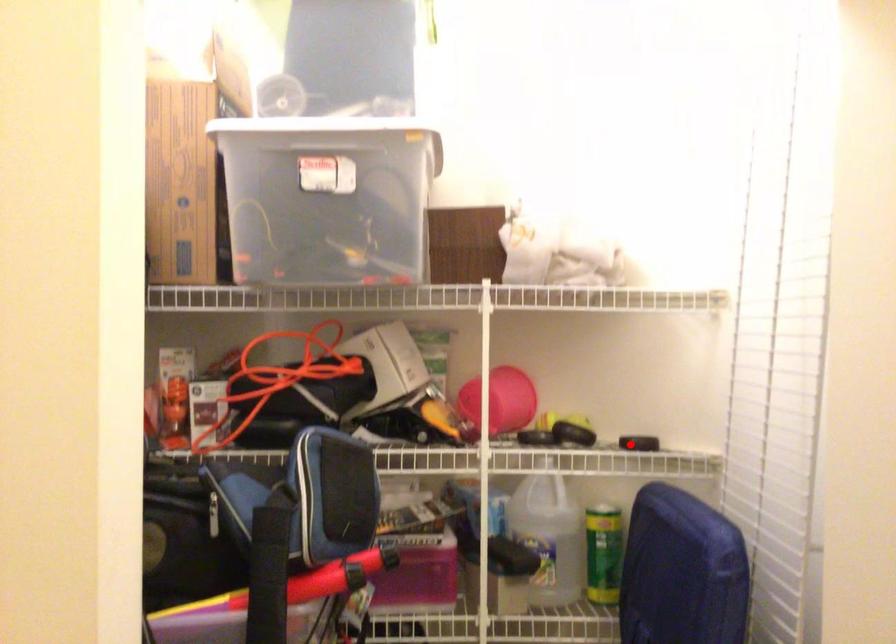
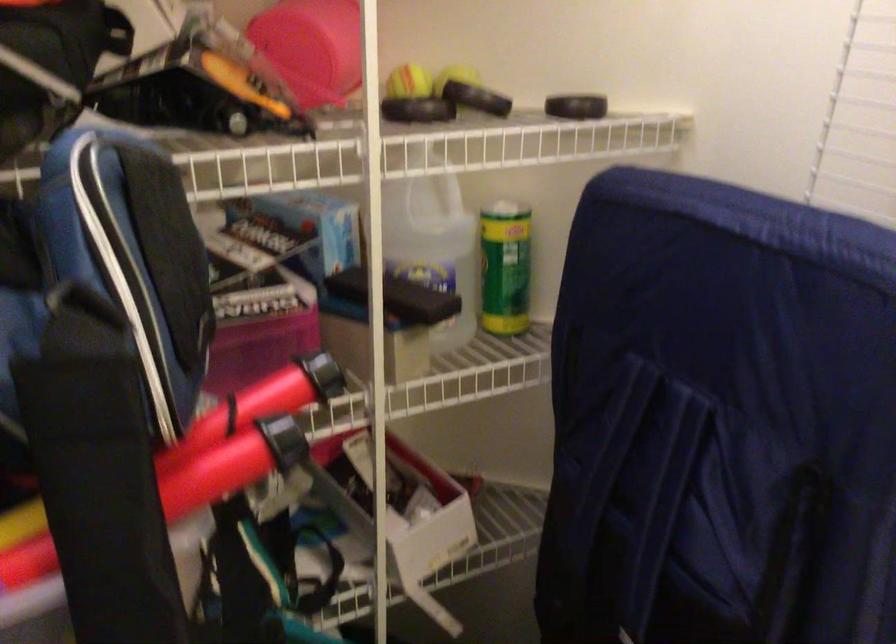
Question: I am providing you with two images of the same scene from different viewpoints. A red point is shown in image1. For the corresponding object point in image2, is it positioned nearer or farther from the camera?

Choices:
 (A) Nearer
 (B) Farther

Answer: (A)